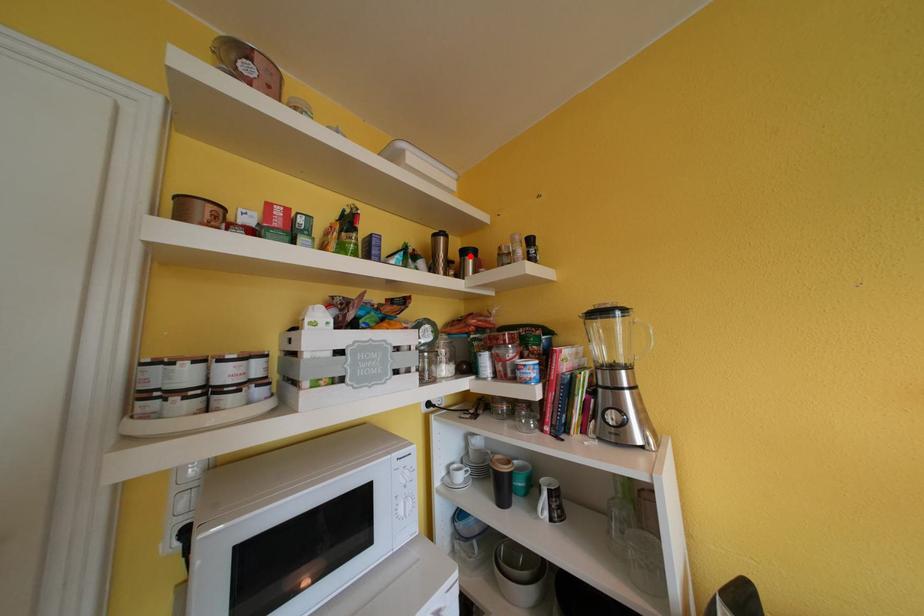
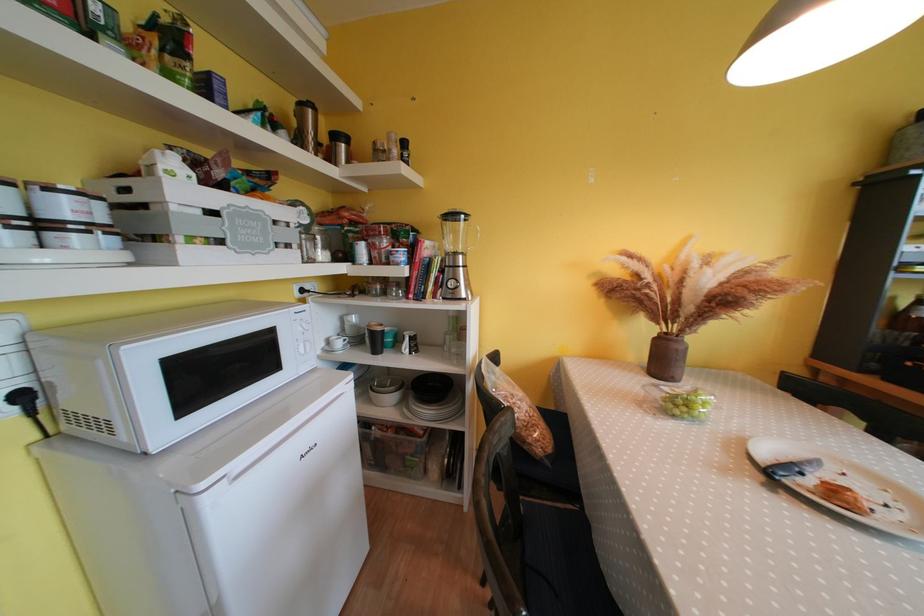
Find the pixel in the second image that matches the highlighted location in the first image.

(342, 140)